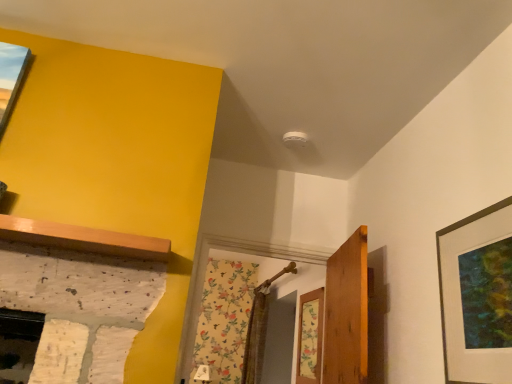
Question: From a real-world perspective, is matte black picture frame at right located beneath wooden door at center?

Choices:
 (A) no
 (B) yes

Answer: (A)

Question: Is the depth of matte black picture frame at right less than that of wooden door at center?

Choices:
 (A) yes
 (B) no

Answer: (A)

Question: Does matte black picture frame at right have a greater height compared to wooden door at center?

Choices:
 (A) yes
 (B) no

Answer: (B)

Question: From a real-world perspective, is matte black picture frame at right located higher than wooden door at center?

Choices:
 (A) no
 (B) yes

Answer: (B)

Question: Is matte black picture frame at right outside of wooden door at center?

Choices:
 (A) no
 (B) yes

Answer: (B)

Question: From the image's perspective, relative to wooden door at center, is floral wallpaper at center above or below?

Choices:
 (A) below
 (B) above

Answer: (A)

Question: Is floral wallpaper at center bigger or smaller than wooden door at center?

Choices:
 (A) big
 (B) small

Answer: (B)

Question: From their relative heights in the image, would you say floral wallpaper at center is taller or shorter than wooden door at center?

Choices:
 (A) tall
 (B) short

Answer: (B)

Question: From a real-world perspective, relative to wooden door at center, is floral wallpaper at center vertically above or below?

Choices:
 (A) below
 (B) above

Answer: (A)

Question: Is wooden door at center taller or shorter than matte black picture frame at right?

Choices:
 (A) tall
 (B) short

Answer: (A)

Question: Would you say wooden door at center is to the left or to the right of matte black picture frame at right in the picture?

Choices:
 (A) right
 (B) left

Answer: (B)

Question: Looking at the image, does wooden door at center seem bigger or smaller compared to matte black picture frame at right?

Choices:
 (A) big
 (B) small

Answer: (A)

Question: In the image, is wooden door at center positioned in front of or behind matte black picture frame at right?

Choices:
 (A) behind
 (B) front

Answer: (A)

Question: From the image's perspective, is matte black picture frame at right above or below wooden door at center?

Choices:
 (A) above
 (B) below

Answer: (A)

Question: Is matte black picture frame at right wider or thinner than wooden door at center?

Choices:
 (A) thin
 (B) wide

Answer: (A)